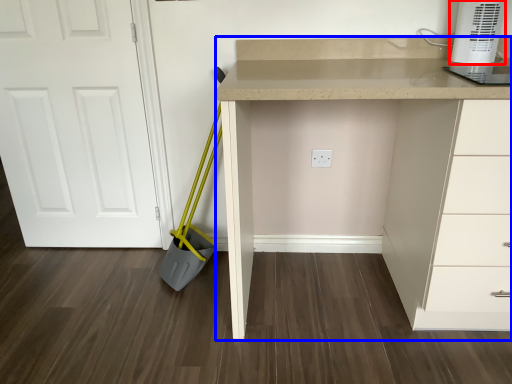
Question: Which point is further to the camera, home appliance (highlighted by a red box) or computer desk (highlighted by a blue box)?

Choices:
 (A) home appliance
 (B) computer desk

Answer: (A)